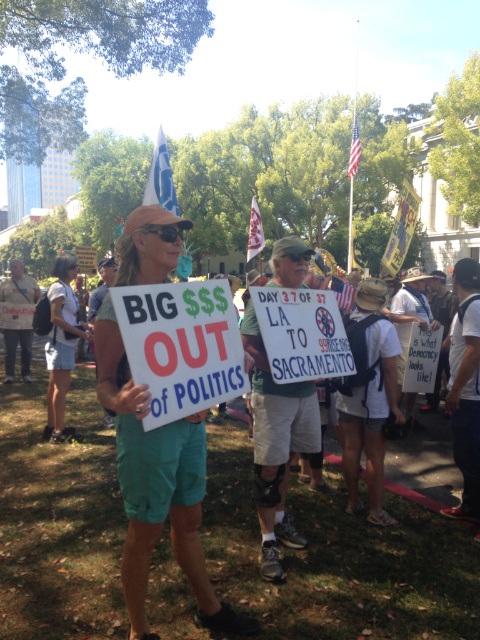
You are a photographer trying to capture a photo of the protest scene. You want to ensure both the teal fabric shorts at center and the denim shorts at lower left are clearly visible. Based on their positions, which of these two items should you focus on first to ensure depth of field captures both?

The teal fabric shorts at center should be focused on first since it is closer to the viewer than the denim shorts at lower left. By focusing on the closer object, the depth of field will extend backward, potentially keeping both in focus.

You are a photographer at the protest scene. You want to take a photo that includes both the teal fabric shorts at center and the denim shorts at lower left. Which pair of shorts should you focus on to ensure both are clearly visible in the frame?

The teal fabric shorts at center is bigger than denim shorts at lower left, so focusing on the teal fabric shorts at center will ensure both are clearly visible in the frame.